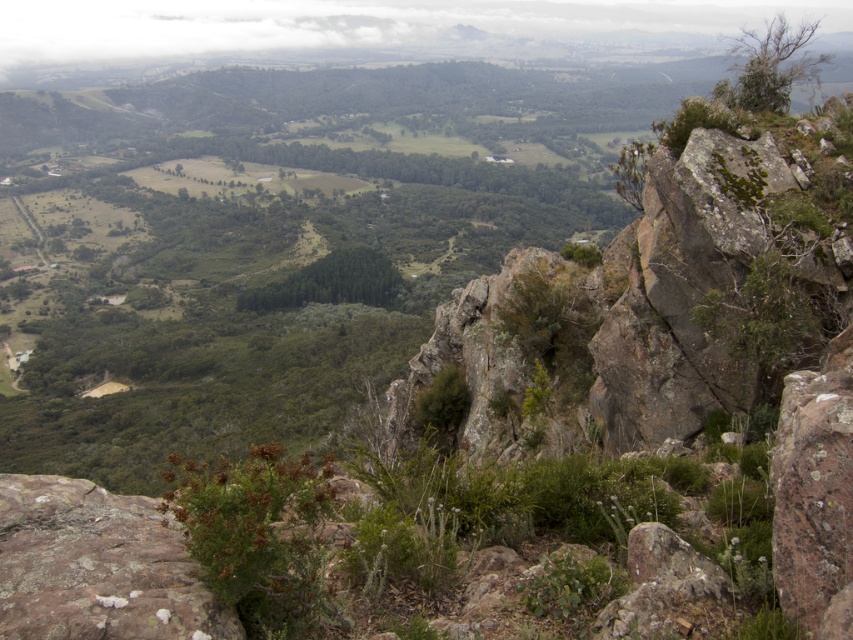
You are a geologist examining the valley from above. You notice two rusty rocks labeled as rusty rock at lower left and rusty rock at center. Based on their positions, which one is closer to you?

The rusty rock at lower left is closer to you because it is positioned above the rusty rock at center, indicating it is nearer in the vantage point.

You are a geologist standing at the center of the valley. You need to locate the rusty rock at lower left. According to the coordinates provided, where should you look relative to your position?

The rusty rock at lower left is located at coordinates point (97, 566), which means it is positioned to the lower left relative to your central viewpoint.